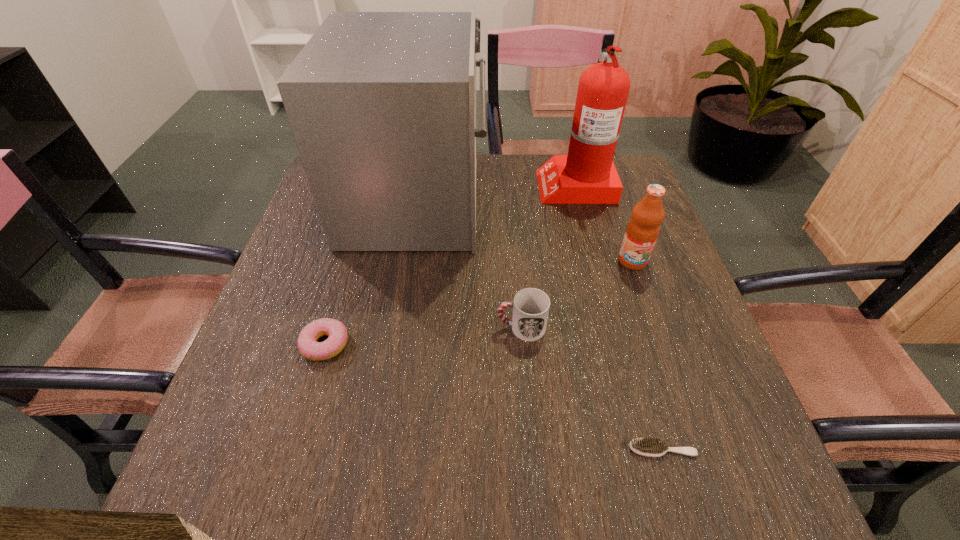
You are a GUI agent. You are given a task and a screenshot of the screen. Output one action in this format:
    pyautogui.click(x=<x>, y=<y>)
    Task: Click on the vacant point located between the fire extinguisher and the fourth object from right to left
    Image resolution: width=960 pixels, height=540 pixels.
    Given the screenshot: What is the action you would take?
    pyautogui.click(x=548, y=256)

Find the location of `free space between the fifth tallest object and the third shortest object`. free space between the fifth tallest object and the third shortest object is located at coordinates pyautogui.click(x=423, y=336).

Where is `free spot between the fruit juice and the fire extinguisher`? free spot between the fruit juice and the fire extinguisher is located at coordinates (604, 222).

Select which object is the second closest to the third shortest object. Please provide its 2D coordinates. Your answer should be formatted as a tuple, i.e. [(x, y)], where the tuple contains the x and y coordinates of a point satisfying the conditions above.

[(642, 230)]

Select which object is the second closest to the fourth object from right to left. Please provide its 2D coordinates. Your answer should be formatted as a tuple, i.e. [(x, y)], where the tuple contains the x and y coordinates of a point satisfying the conditions above.

[(642, 230)]

At what (x,y) coordinates should I click in order to perform the action: click on vacant space that satisfies the following two spatial constraints: 1. on the front panel of the toaster oven; 2. on the back side of the shortest object. Please return your answer as a coordinate pair (x, y). This screenshot has height=540, width=960. Looking at the image, I should click on (376, 448).

Image resolution: width=960 pixels, height=540 pixels. What are the coordinates of `free location that satisfies the following two spatial constraints: 1. on the front panel of the toaster oven; 2. on the side of the fourth tallest object where the handle is located` in the screenshot? It's located at (396, 327).

Where is `vacant space that satisfies the following two spatial constraints: 1. on the front panel of the shortest object; 2. on the right side of the toaster oven`? vacant space that satisfies the following two spatial constraints: 1. on the front panel of the shortest object; 2. on the right side of the toaster oven is located at coordinates (376, 448).

Image resolution: width=960 pixels, height=540 pixels. I want to click on free space that satisfies the following two spatial constraints: 1. on the back side of the nearest object; 2. on the front-facing side of the fire extinguisher, so click(586, 184).